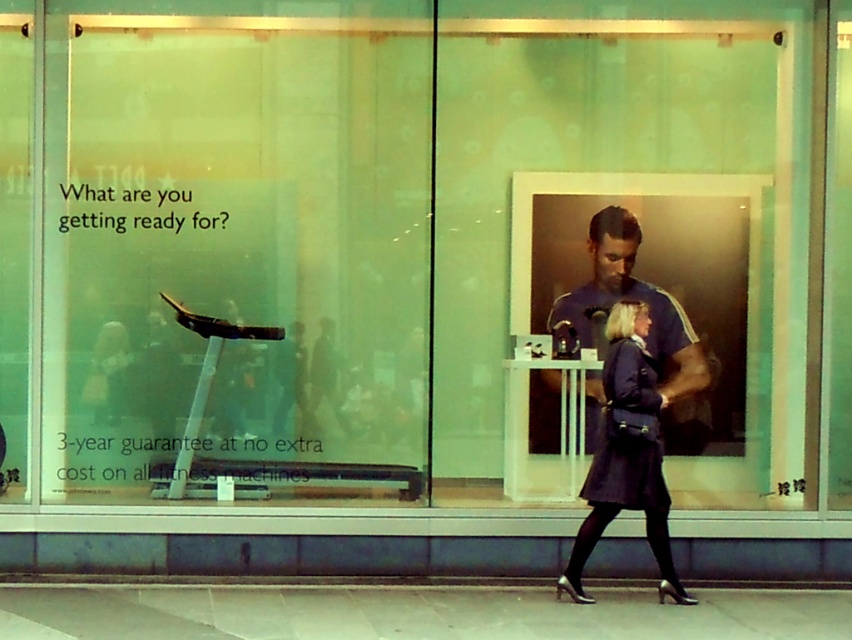
Is point (684, 600) closer to viewer compared to point (660, 502)?

No, it is not.

Can you confirm if dark blue fabric coat at lower center is shorter than dark blue fabric coat at center?

No.

From the picture: Who is more distant from viewer, (642, 369) or (653, 456)?

Point (653, 456)

This screenshot has width=852, height=640. I want to click on dark blue fabric coat at lower center, so click(x=626, y=452).

Can you confirm if blue athletic shirt at center is bigger than dark blue fabric coat at center?

Yes, blue athletic shirt at center is bigger than dark blue fabric coat at center.

Is blue athletic shirt at center to the left of dark blue fabric coat at center from the viewer's perspective?

No, blue athletic shirt at center is not to the left of dark blue fabric coat at center.

The image size is (852, 640). In order to click on blue athletic shirt at center in this screenshot , I will do `click(649, 316)`.

Does smooth concrete pavement at lower center have a lesser height compared to blue athletic shirt at center?

Indeed, smooth concrete pavement at lower center has a lesser height compared to blue athletic shirt at center.

Does point (502, 625) come farther from viewer compared to point (597, 308)?

No, it is not.

You are a GUI agent. You are given a task and a screenshot of the screen. Output one action in this format:
    pyautogui.click(x=<x>, y=<y>)
    Task: Click on the smooth concrete pavement at lower center
    
    Given the screenshot: What is the action you would take?
    pyautogui.click(x=410, y=612)